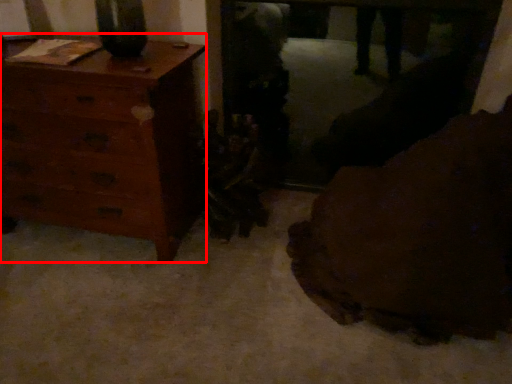
Question: In this image, where is chest of drawers (annotated by the red box) located relative to furniture?

Choices:
 (A) left
 (B) right

Answer: (A)